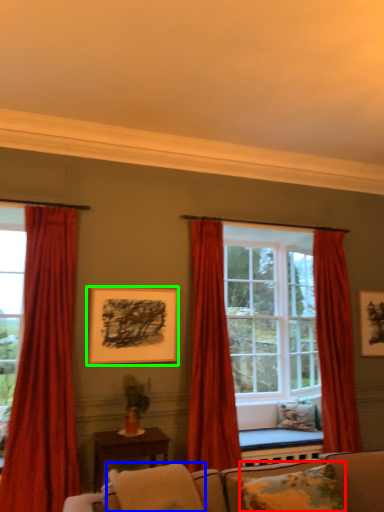
Question: Estimate the real-world distances between objects in this image. Which object is farther from pillow (highlighted by a red box), pillow (highlighted by a blue box) or picture frame (highlighted by a green box)?

Choices:
 (A) pillow
 (B) picture frame

Answer: (B)